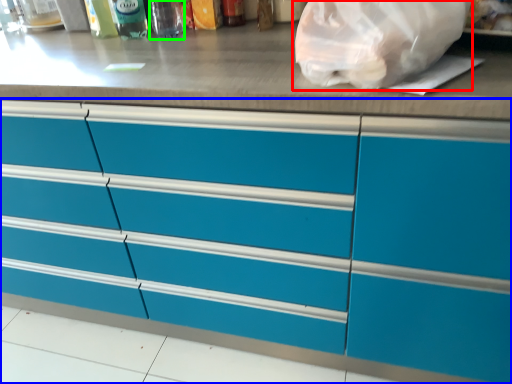
Question: Which object is the farthest from plastic bag (highlighted by a red box)? Choose among these: cabinetry (highlighted by a blue box) or bottle (highlighted by a green box).

Choices:
 (A) cabinetry
 (B) bottle

Answer: (B)